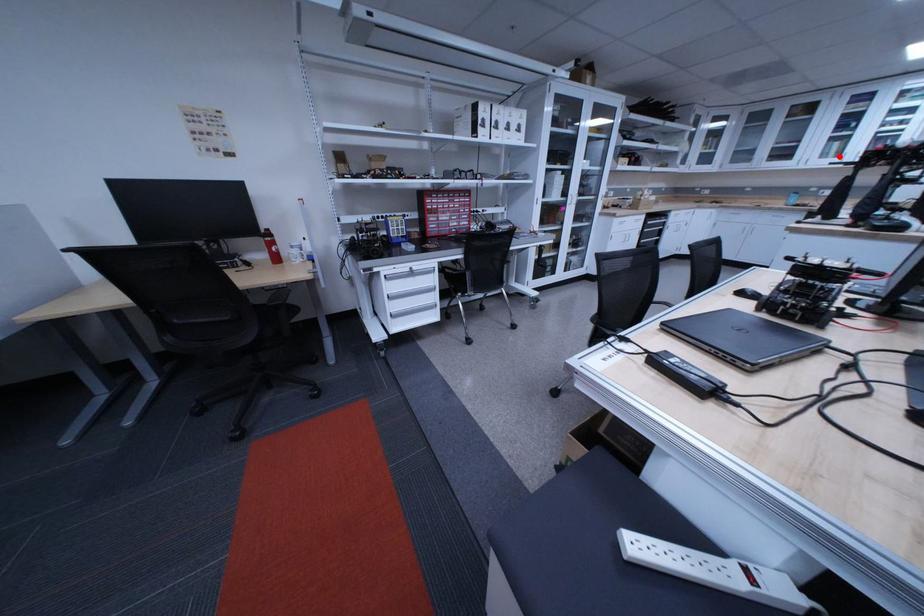
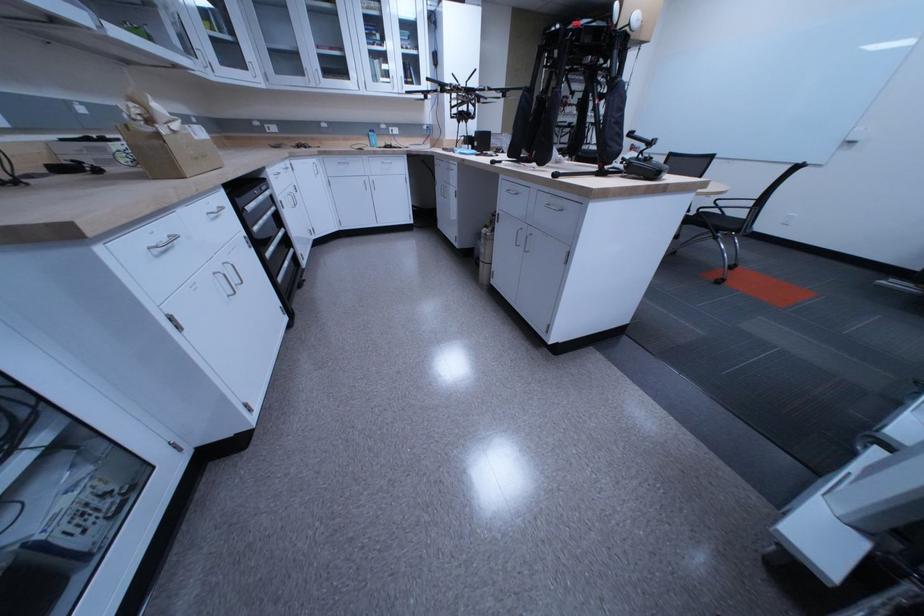
Question: I am providing you with two images of the same scene from different viewpoints. Given a red point in image1, look at the same physical point in image2. Is it:

Choices:
 (A) Closer to the viewpoint
 (B) Farther from the viewpoint

Answer: (A)